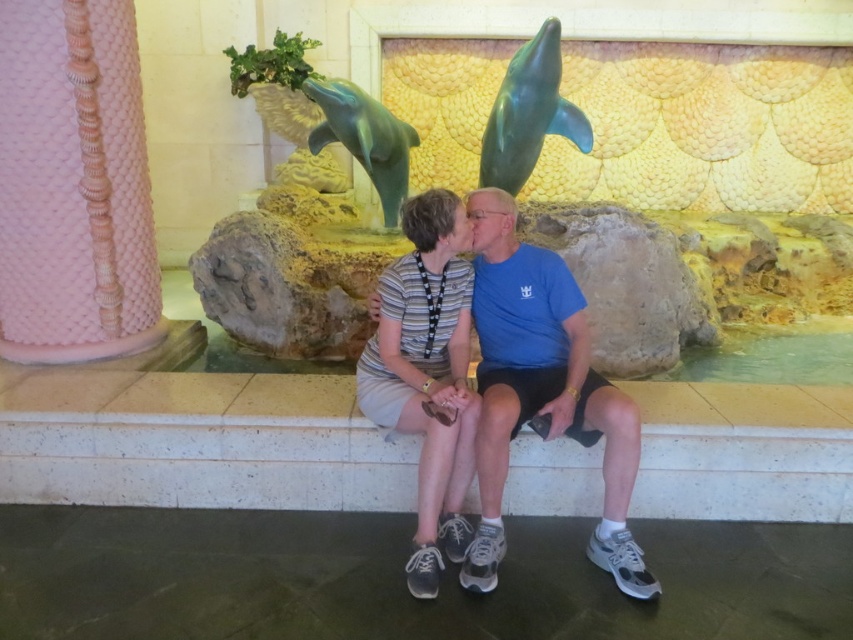
Question: From the image, what is the correct spatial relationship of shiny green dolphin at upper center in relation to shiny green dolphin at center?

Choices:
 (A) left
 (B) right

Answer: (B)

Question: Which object is positioned closest to the striped fabric dress at center?

Choices:
 (A) shiny green dolphin at center
 (B) shiny green dolphin at upper center

Answer: (A)

Question: Is striped fabric dress at center positioned behind shiny green dolphin at upper center?

Choices:
 (A) no
 (B) yes

Answer: (A)

Question: Which point is farther to the camera?

Choices:
 (A) blue cotton shirt at center
 (B) shiny green dolphin at center

Answer: (B)

Question: Can you confirm if blue cotton shirt at center is wider than striped fabric dress at center?

Choices:
 (A) yes
 (B) no

Answer: (A)

Question: Which point is farther from the camera taking this photo?

Choices:
 (A) (456, 474)
 (B) (502, 186)
 (C) (399, 196)
 (D) (605, 436)

Answer: (C)